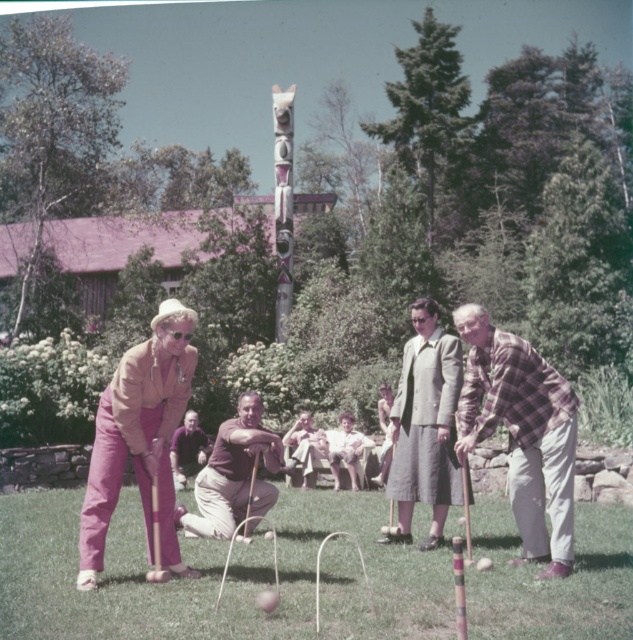
Is plaid fabric croquet mallet at center to the left of brown cotton shirt at center from the viewer's perspective?

In fact, plaid fabric croquet mallet at center is to the right of brown cotton shirt at center.

Is plaid fabric croquet mallet at center wider than brown cotton shirt at center?

In fact, plaid fabric croquet mallet at center might be narrower than brown cotton shirt at center.

Where is `plaid fabric croquet mallet at center`? This screenshot has width=633, height=640. plaid fabric croquet mallet at center is located at coordinates (522, 433).

Looking at this image, can you confirm if plaid fabric croquet mallet at center is positioned below matte pink pants at center?

Incorrect, plaid fabric croquet mallet at center is not positioned below matte pink pants at center.

Identify the location of plaid fabric croquet mallet at center. click(522, 433).

Find the location of a particular element. plaid fabric croquet mallet at center is located at coordinates (522, 433).

Which is below, plaid fabric croquet mallet at center or gray woolen suit at center?

plaid fabric croquet mallet at center is lower down.

Between plaid fabric croquet mallet at center and gray woolen suit at center, which one appears on the right side from the viewer's perspective?

From the viewer's perspective, plaid fabric croquet mallet at center appears more on the right side.

Which is in front, point (518, 384) or point (422, 323)?

Point (518, 384) is more forward.

Locate an element on the screen. The height and width of the screenshot is (640, 633). plaid fabric croquet mallet at center is located at coordinates (522, 433).